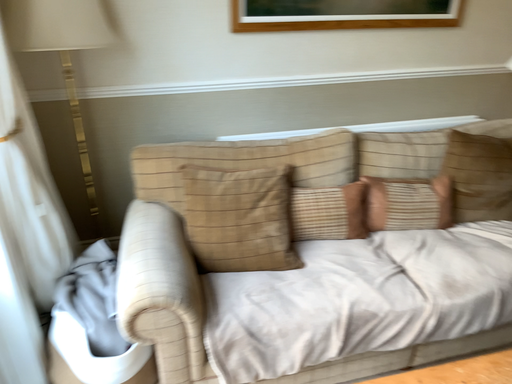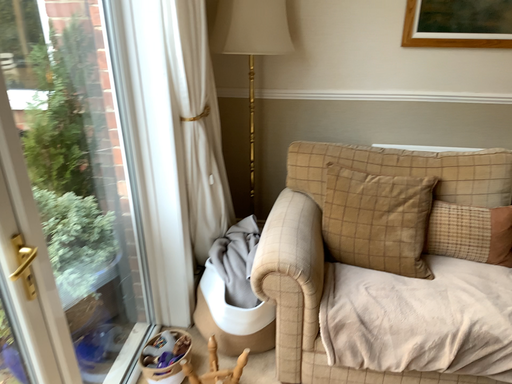
Question: How did the camera likely rotate when shooting the video?

Choices:
 (A) rotated left
 (B) rotated right

Answer: (A)